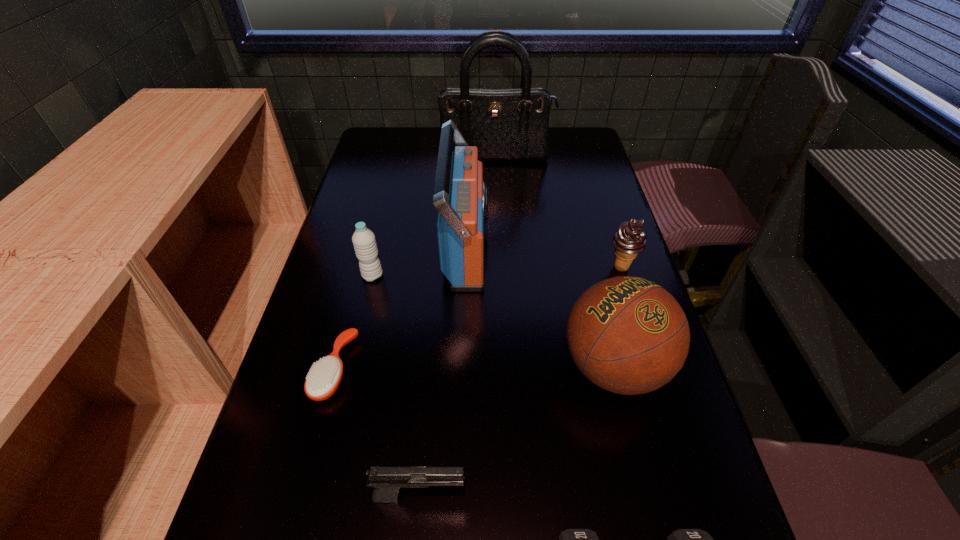
Where is `basketball that is at the right edge`? basketball that is at the right edge is located at coordinates (627, 335).

Where is `icecream that is positioned at the right edge`? This screenshot has height=540, width=960. icecream that is positioned at the right edge is located at coordinates (629, 240).

Where is `object that is at the far right corner`? Image resolution: width=960 pixels, height=540 pixels. object that is at the far right corner is located at coordinates (504, 124).

At what (x,y) coordinates should I click in order to perform the action: click on vacant position at the left edge of the desktop. Please return your answer as a coordinate pair (x, y). The image size is (960, 540). Looking at the image, I should click on (396, 179).

Locate an element on the screen. The height and width of the screenshot is (540, 960). vacant space at the right edge is located at coordinates (581, 254).

This screenshot has height=540, width=960. In the image, there is a desktop. Identify the location of vacant space at the far right corner. (564, 152).

Locate an element on the screen. The image size is (960, 540). free space between the basketball and the pistol is located at coordinates (516, 431).

The width and height of the screenshot is (960, 540). I want to click on free space between the icecream and the third shortest object, so click(520, 381).

The height and width of the screenshot is (540, 960). I want to click on free spot between the pistol and the farthest object, so click(x=458, y=327).

The image size is (960, 540). I want to click on vacant space in between the basketball and the radio receiver, so click(x=540, y=308).